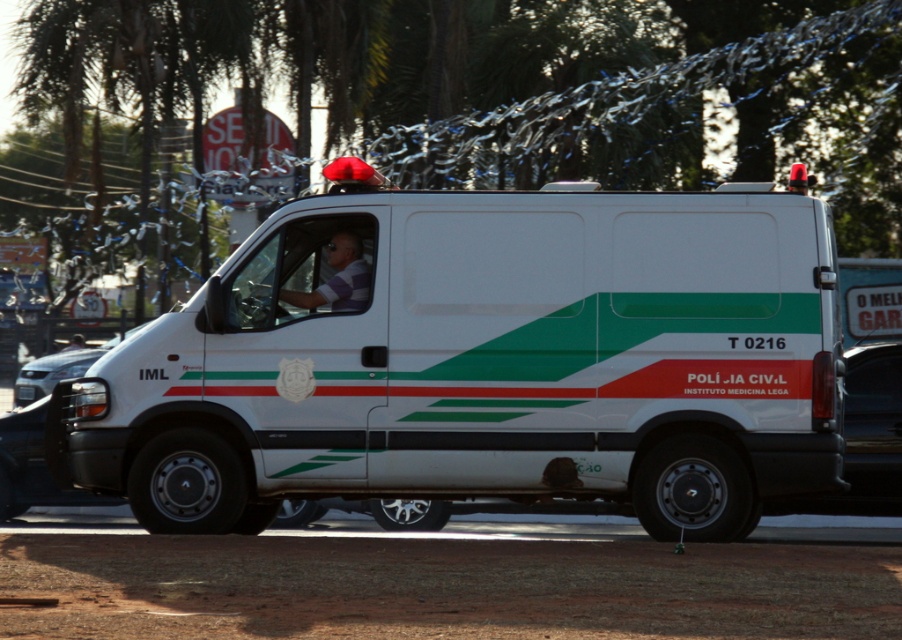
Question: Does white striped shirt at center have a smaller size compared to matte white headlight at left?

Choices:
 (A) yes
 (B) no

Answer: (A)

Question: Which is nearer to the matte white headlight at left?

Choices:
 (A) white glossy van at center
 (B) white matte van at center
 (C) white striped shirt at center

Answer: (A)

Question: Is the position of white matte van at center less distant than that of matte white headlight at left?

Choices:
 (A) yes
 (B) no

Answer: (A)

Question: Which point is farther from the camera taking this photo?

Choices:
 (A) (744, 218)
 (B) (81, 340)

Answer: (B)

Question: Is white matte van at center to the right of white striped shirt at center from the viewer's perspective?

Choices:
 (A) no
 (B) yes

Answer: (B)

Question: Which point is farther to the camera?

Choices:
 (A) white striped shirt at center
 (B) matte white headlight at left

Answer: (B)